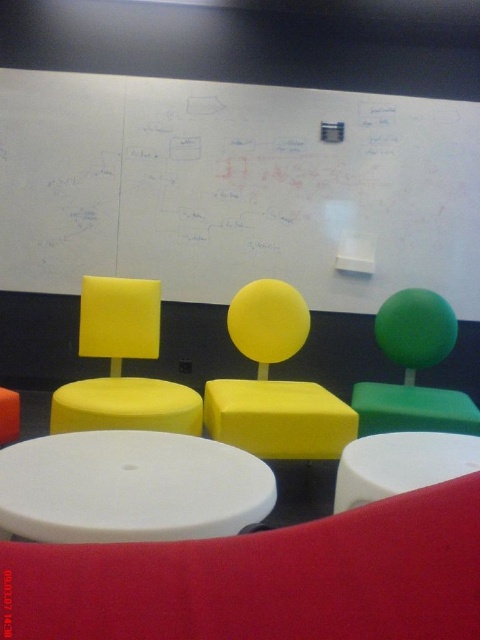
Question: Where is white matte round table at center located in relation to orange matte stool at lower left in the image?

Choices:
 (A) left
 (B) right

Answer: (B)

Question: Based on their relative distances, which object is nearer to the white glossy table at center?

Choices:
 (A) yellow matte stool at center
 (B) green matte chair at right
 (C) white matte round table at center
 (D) yellow matte chair at center

Answer: (C)

Question: Does whiteboard at upper center appear over green matte chair at right?

Choices:
 (A) no
 (B) yes

Answer: (B)

Question: Which object is positioned closest to the white matte round table at center?

Choices:
 (A) yellow matte chair at center
 (B) whiteboard at upper center
 (C) orange matte stool at lower left
 (D) yellow matte stool at center

Answer: (D)

Question: Which is farther from the green matte chair at right?

Choices:
 (A) white glossy table at center
 (B) white matte round table at center
 (C) yellow matte stool at center
 (D) matte yellow chair at center

Answer: (B)

Question: Is white glossy table at center to the right of yellow matte stool at center from the viewer's perspective?

Choices:
 (A) no
 (B) yes

Answer: (B)